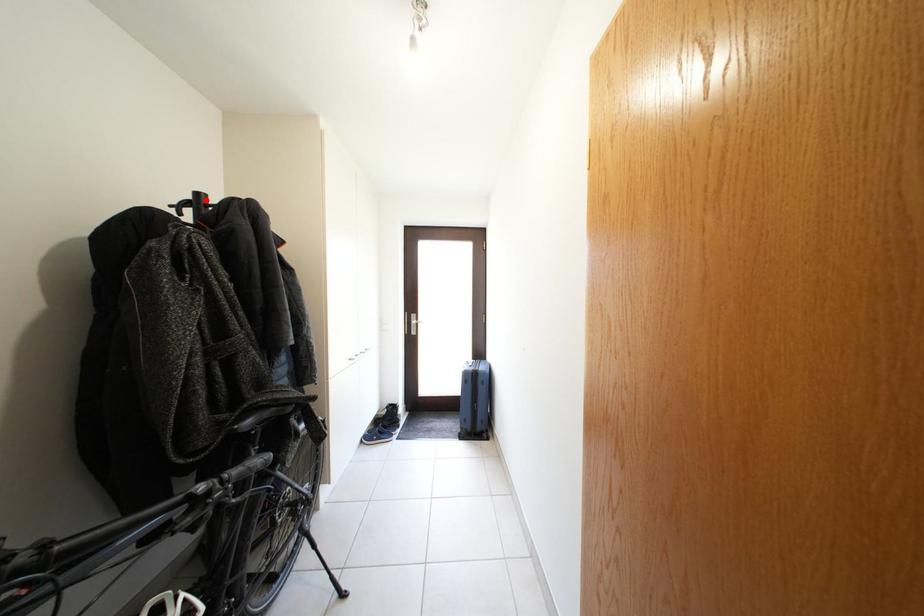
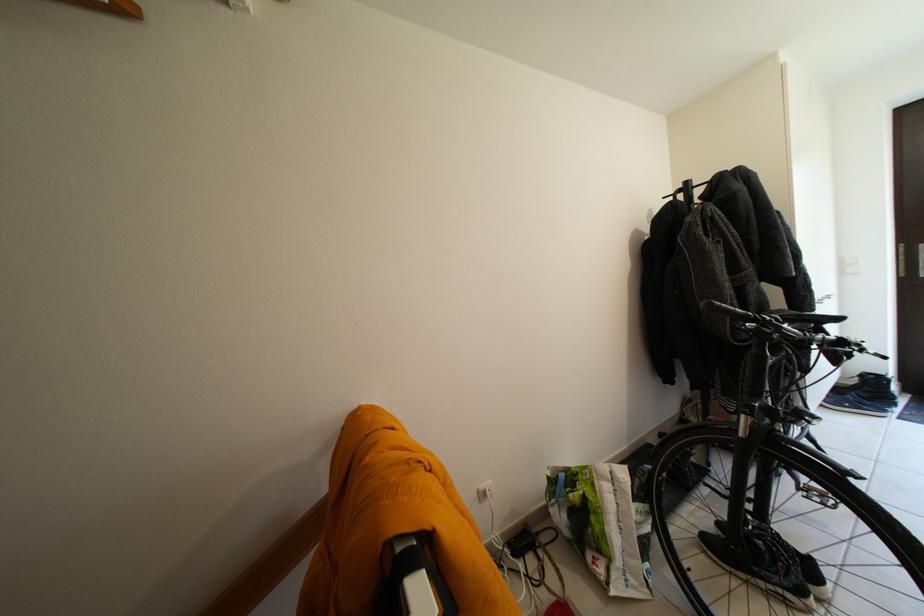
Locate, in the second image, the point that corresponds to the highlighted location in the first image.

(696, 188)